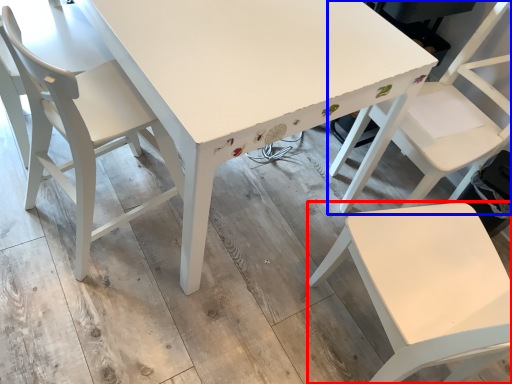
Question: Which object is closer to the camera taking this photo, chair (highlighted by a red box) or chair (highlighted by a blue box)?

Choices:
 (A) chair
 (B) chair

Answer: (A)